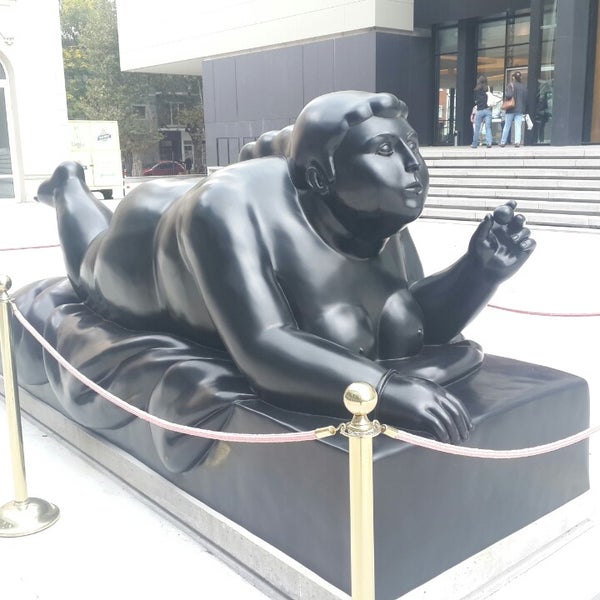
Locate an element on the screen. This screenshot has width=600, height=600. doors is located at coordinates (473, 90).